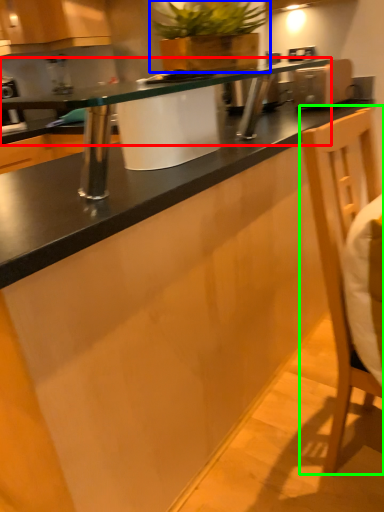
Question: Based on their relative distances, which object is farther from countertop (highlighted by a red box)? Choose from houseplant (highlighted by a blue box) and swivel chair (highlighted by a green box).

Choices:
 (A) houseplant
 (B) swivel chair

Answer: (A)